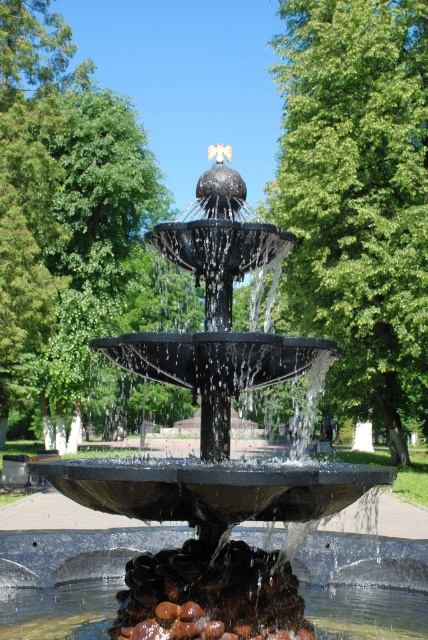
Question: Is green leafy tree at center to the right of green leafy tree at upper center from the viewer's perspective?

Choices:
 (A) yes
 (B) no

Answer: (A)

Question: Which point is closer to the camera?

Choices:
 (A) (392, 394)
 (B) (23, 243)

Answer: (B)

Question: Among these points, which one is farthest from the camera?

Choices:
 (A) (73, 49)
 (B) (354, 237)

Answer: (A)

Question: Does green leafy tree at center appear under green leafy tree at upper center?

Choices:
 (A) no
 (B) yes

Answer: (A)

Question: Does green leafy tree at center have a smaller size compared to green leafy tree at upper center?

Choices:
 (A) yes
 (B) no

Answer: (A)